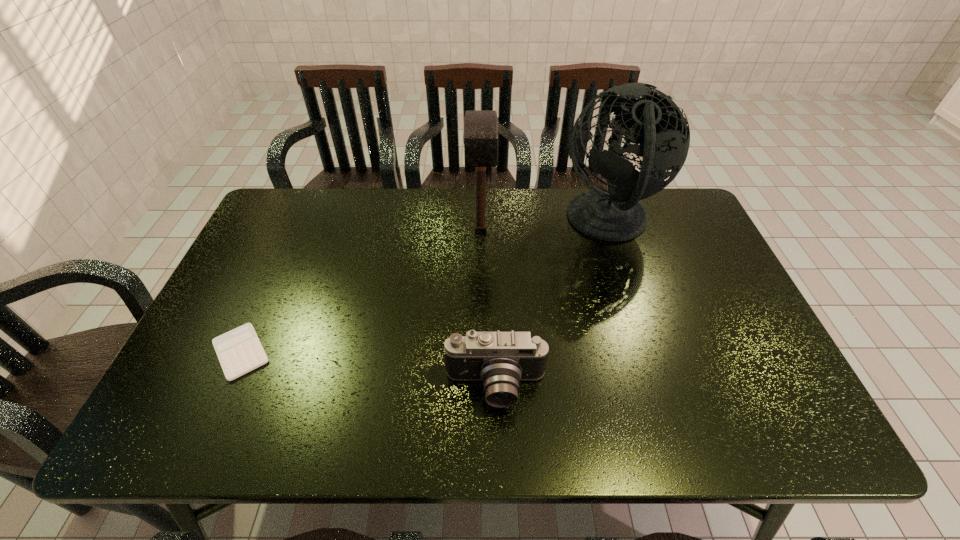
The height and width of the screenshot is (540, 960). I want to click on vacant region at the left edge of the desktop, so click(205, 381).

In the image, there is a desktop. What are the coordinates of `vacant space at the right edge` in the screenshot? It's located at (682, 289).

The height and width of the screenshot is (540, 960). In the image, there is a desktop. What are the coordinates of `vacant space at the far right corner` in the screenshot? It's located at (666, 232).

You are a GUI agent. You are given a task and a screenshot of the screen. Output one action in this format:
    pyautogui.click(x=<x>, y=<y>)
    Task: Click on the free spot between the shortest object and the tallest object
    This screenshot has height=540, width=960.
    Given the screenshot: What is the action you would take?
    424,287

Image resolution: width=960 pixels, height=540 pixels. Find the location of `empty space between the rightmost object and the second tallest object`. empty space between the rightmost object and the second tallest object is located at coordinates (544, 226).

I want to click on vacant point located between the shortest object and the mallet, so click(x=361, y=292).

Where is `unoccupied position between the leftmost object and the tallest object`? Image resolution: width=960 pixels, height=540 pixels. unoccupied position between the leftmost object and the tallest object is located at coordinates (424, 287).

Identify the location of vacant space that's between the third shortest object and the leftmost object. (361, 292).

Find the location of a particular element. The height and width of the screenshot is (540, 960). vacant point located between the calculator and the second shortest object is located at coordinates (369, 370).

The height and width of the screenshot is (540, 960). Find the location of `vacant space that is in between the leftmost object and the mallet`. vacant space that is in between the leftmost object and the mallet is located at coordinates (361, 292).